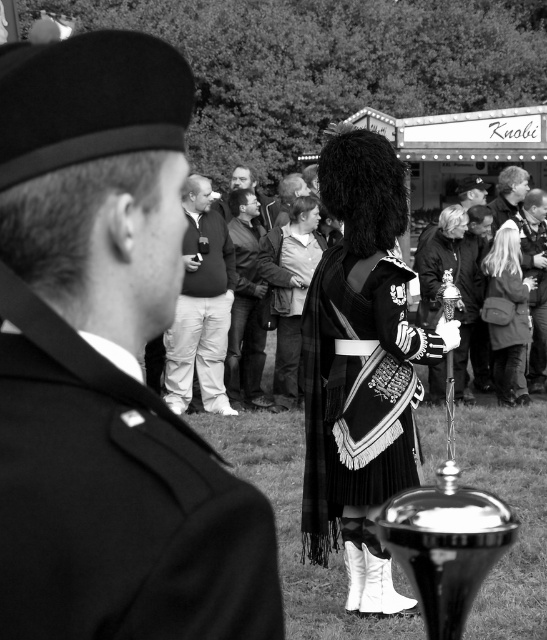
Question: Based on their relative distances, which object is nearer to the silky black dress at center?

Choices:
 (A) smooth leather jacket at center
 (B) uniformed man at center

Answer: (A)

Question: Does light brown leather jacket at upper right appear on the right side of smooth leather jacket at center?

Choices:
 (A) yes
 (B) no

Answer: (A)

Question: Which is nearer to the light brown leather jacket at upper right?

Choices:
 (A) matte black jacket at upper center
 (B) smooth leather jacket at center
 (C) silky black dress at center

Answer: (C)

Question: Is smooth leather jacket at upper right above matte black jacket at upper center?

Choices:
 (A) no
 (B) yes

Answer: (A)

Question: Is black woolen kilt at center positioned in front of matte black jacket at right?

Choices:
 (A) yes
 (B) no

Answer: (A)

Question: Considering the real-world distances, which object is closest to the light brown leather jacket at upper right?

Choices:
 (A) smooth leather jacket at upper right
 (B) matte black jacket at upper center
 (C) silky black dress at center

Answer: (A)